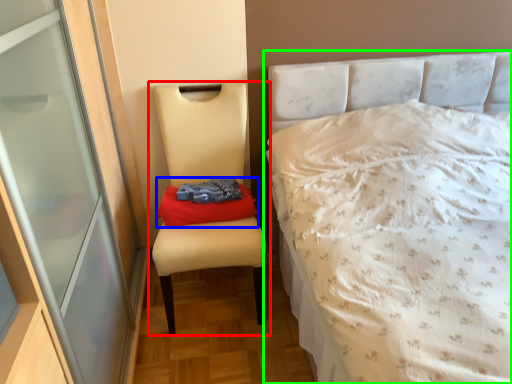
Question: Based on their relative distances, which object is farther from chair (highlighted by a red box)? Choose from material (highlighted by a blue box) and bed (highlighted by a green box).

Choices:
 (A) material
 (B) bed

Answer: (B)